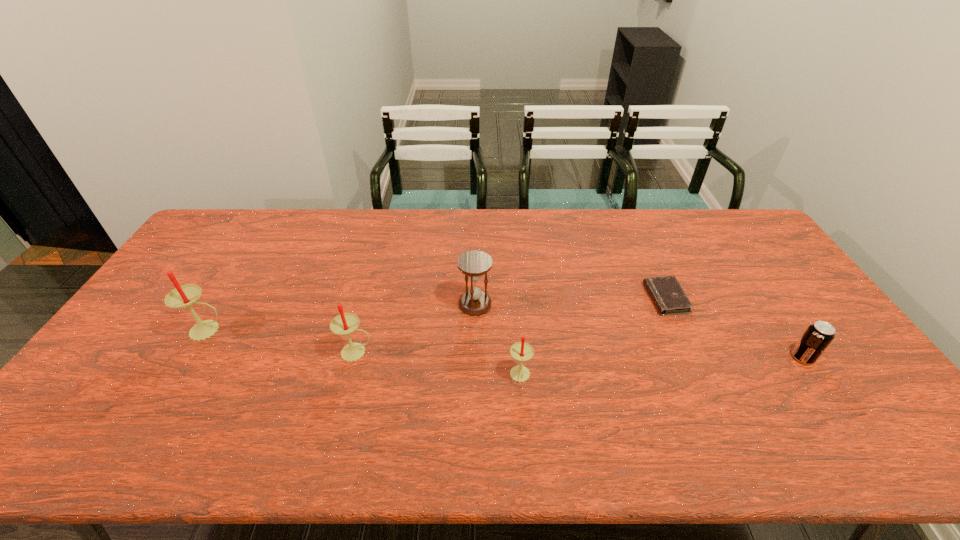
This screenshot has width=960, height=540. In order to click on the tallest candle in this screenshot , I will do `click(182, 296)`.

Identify the location of the tallest object. This screenshot has width=960, height=540. (182, 296).

The image size is (960, 540). What are the coordinates of `the second object from left to right` in the screenshot? It's located at (345, 323).

Identify the location of the second candle from left to right. (345, 323).

The image size is (960, 540). I want to click on the nearest candle, so click(521, 351).

You are a GUI agent. You are given a task and a screenshot of the screen. Output one action in this format:
    pyautogui.click(x=<x>, y=<y>)
    Task: Click on the fourth object from left to right
    This screenshot has width=960, height=540.
    Given the screenshot: What is the action you would take?
    pyautogui.click(x=521, y=351)

The width and height of the screenshot is (960, 540). Find the location of `the fourth object from right to left`. the fourth object from right to left is located at coordinates (473, 264).

What are the coordinates of `soda can` in the screenshot? It's located at (817, 337).

Where is `the fifth tallest object`? Image resolution: width=960 pixels, height=540 pixels. the fifth tallest object is located at coordinates (817, 337).

The width and height of the screenshot is (960, 540). Identify the location of the shortest object. (667, 294).